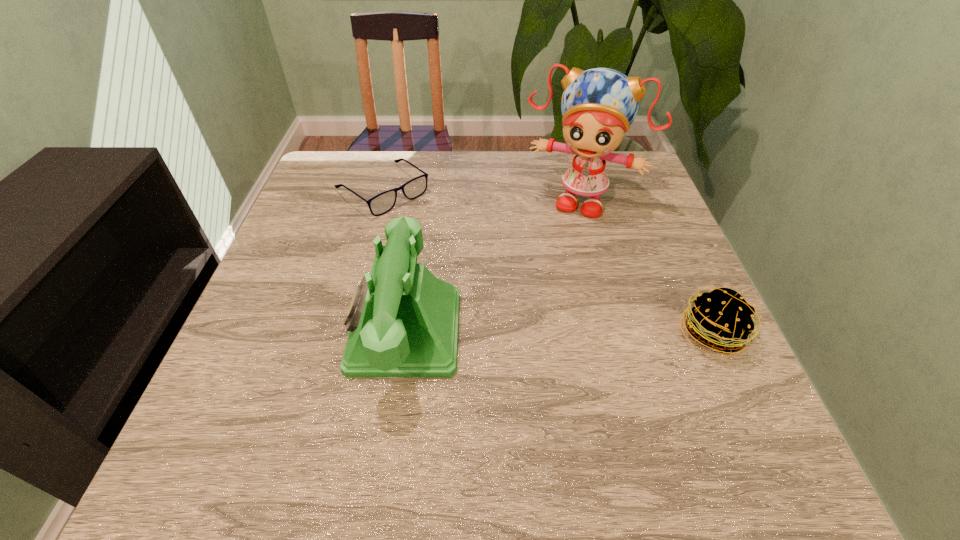
The height and width of the screenshot is (540, 960). I want to click on vacant point located on the front-facing side of the shortest object, so click(x=438, y=233).

I want to click on vacant point located 0.230m on the front-facing side of the shortest object, so click(x=470, y=259).

Find the location of a particular element. free location located 0.100m on the front-facing side of the shortest object is located at coordinates (435, 231).

Identify the location of doll located at the far edge. (599, 105).

Where is `spectacles present at the far edge`? This screenshot has width=960, height=540. spectacles present at the far edge is located at coordinates (382, 203).

This screenshot has height=540, width=960. Identify the location of object present at the near edge. (403, 321).

Identify the location of object that is at the left edge. (382, 203).

Where is `patty present at the right edge`? patty present at the right edge is located at coordinates (721, 319).

At what (x,y) coordinates should I click in order to perform the action: click on doll that is positioned at the right edge. Please return your answer as a coordinate pair (x, y). The image size is (960, 540). Looking at the image, I should click on (599, 105).

Identify the location of object present at the far left corner. (382, 203).